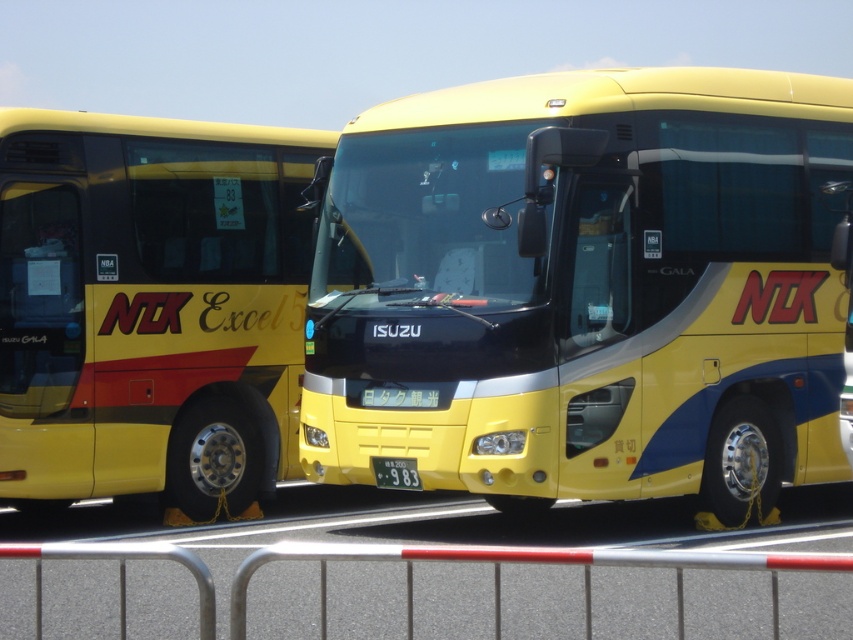
Is yellow matte bus at center to the left of silver metallic rail at lower center from the viewer's perspective?

No, yellow matte bus at center is not to the left of silver metallic rail at lower center.

Can you confirm if yellow matte bus at center is positioned to the right of silver metallic rail at lower center?

Correct, you'll find yellow matte bus at center to the right of silver metallic rail at lower center.

Between point (642, 380) and point (738, 616), which one is positioned behind?

Point (642, 380)

Locate an element on the screen. Image resolution: width=853 pixels, height=640 pixels. yellow matte bus at center is located at coordinates (585, 289).

Where is `yellow matte bus at center`? The image size is (853, 640). yellow matte bus at center is located at coordinates [585, 289].

Who is taller, yellow matte bus at center or yellow matte bus at left?

With more height is yellow matte bus at center.

Between point (392, 284) and point (233, 168), which one is positioned behind?

The point (233, 168) is more distant.

Identify the location of yellow matte bus at center. The width and height of the screenshot is (853, 640). (585, 289).

Between yellow matte bus at left and silver metallic rail at lower center, which one appears on the left side from the viewer's perspective?

yellow matte bus at left

The height and width of the screenshot is (640, 853). What do you see at coordinates (149, 307) in the screenshot?
I see `yellow matte bus at left` at bounding box center [149, 307].

Find the location of a particular element. The height and width of the screenshot is (640, 853). yellow matte bus at left is located at coordinates (149, 307).